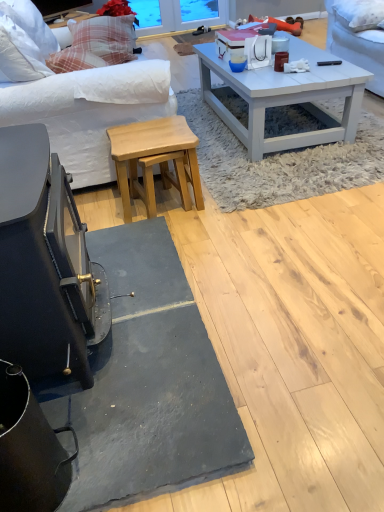
Question: Considering the relative sizes of matte brown coffee cup at center, the 1th coffee cup viewed from the right, and matte black television at upper left in the image provided, is matte brown coffee cup at center, the 1th coffee cup viewed from the right, wider than matte black television at upper left?

Choices:
 (A) no
 (B) yes

Answer: (A)

Question: Considering the relative sizes of matte brown coffee cup at center, the 1th coffee cup viewed from the right, and matte black television at upper left in the image provided, is matte brown coffee cup at center, the 1th coffee cup viewed from the right, bigger than matte black television at upper left?

Choices:
 (A) no
 (B) yes

Answer: (A)

Question: Is matte brown coffee cup at center, positioned as the second coffee cup in left-to-right order, located outside matte black television at upper left?

Choices:
 (A) no
 (B) yes

Answer: (B)

Question: Is matte brown coffee cup at center, positioned as the second coffee cup in left-to-right order, facing towards matte black television at upper left?

Choices:
 (A) yes
 (B) no

Answer: (B)

Question: Considering the relative sizes of matte brown coffee cup at center, the 1th coffee cup viewed from the right, and matte black television at upper left in the image provided, is matte brown coffee cup at center, the 1th coffee cup viewed from the right, taller than matte black television at upper left?

Choices:
 (A) yes
 (B) no

Answer: (B)

Question: Is matte brown coffee cup at center, the 1th coffee cup viewed from the right, positioned behind matte black television at upper left?

Choices:
 (A) no
 (B) yes

Answer: (A)

Question: Is white soft pillow at upper right, placed as the 1th pillow when sorted from right to left, taller than natural wood stool at center?

Choices:
 (A) yes
 (B) no

Answer: (B)

Question: Is the position of white soft pillow at upper right, the 2th pillow positioned from the back, less distant than that of natural wood stool at center?

Choices:
 (A) yes
 (B) no

Answer: (B)

Question: Does white soft pillow at upper right, the 1th pillow in the bottom-to-top sequence, have a lesser height compared to natural wood stool at center?

Choices:
 (A) no
 (B) yes

Answer: (B)

Question: Can you see white soft pillow at upper right, the 2th pillow from the top, touching natural wood stool at center?

Choices:
 (A) no
 (B) yes

Answer: (A)

Question: Does white soft pillow at upper right, the 2th pillow positioned from the back, have a lesser width compared to natural wood stool at center?

Choices:
 (A) no
 (B) yes

Answer: (A)

Question: Is white soft pillow at upper right, acting as the 1th pillow starting from the front, at the left side of natural wood stool at center?

Choices:
 (A) no
 (B) yes

Answer: (A)

Question: From the image's perspective, does white painted wood coffee table at center appear lower than matte blue cup at center, positioned as the 2th coffee cup in right-to-left order?

Choices:
 (A) no
 (B) yes

Answer: (B)